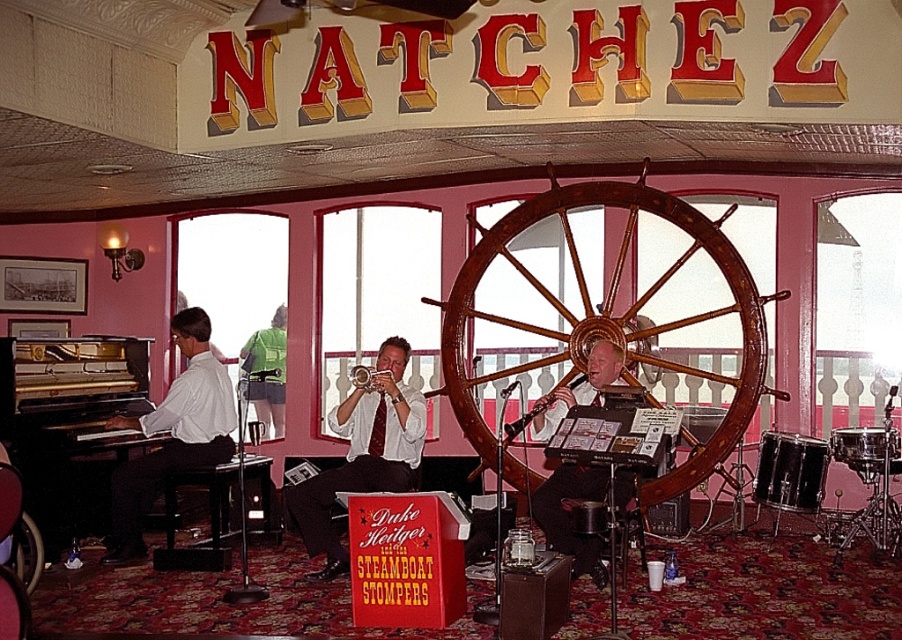
You are a stagehand setting up for the band performance. You have a gold polished piano at left and a white satin trumpet at center. Which object is wider?

The white satin trumpet at center is wider than the gold polished piano at left.

You are a stagehand who needs to hand the white satin trumpet at center to the musician wearing the matte white shirt at left. Can you reach them without moving from your current position?

The white satin trumpet at center and matte white shirt at left are 3.89 feet apart. Since the distance is within a typical reach range, you can likely hand the trumpet without moving.

In the scene shown: You are a photographer positioned in the front row of the Natchez venue. You want to capture a photo of both the white satin trumpet at center and the matte white shirt at left in the same frame. Based on their positions, which object should you place on the left side of your camera frame to ensure both are included?

To include both the white satin trumpet at center and the matte white shirt at left in the same frame, you should place the matte white shirt at left on the left side of your camera frame since the white satin trumpet at center is to the right of it.